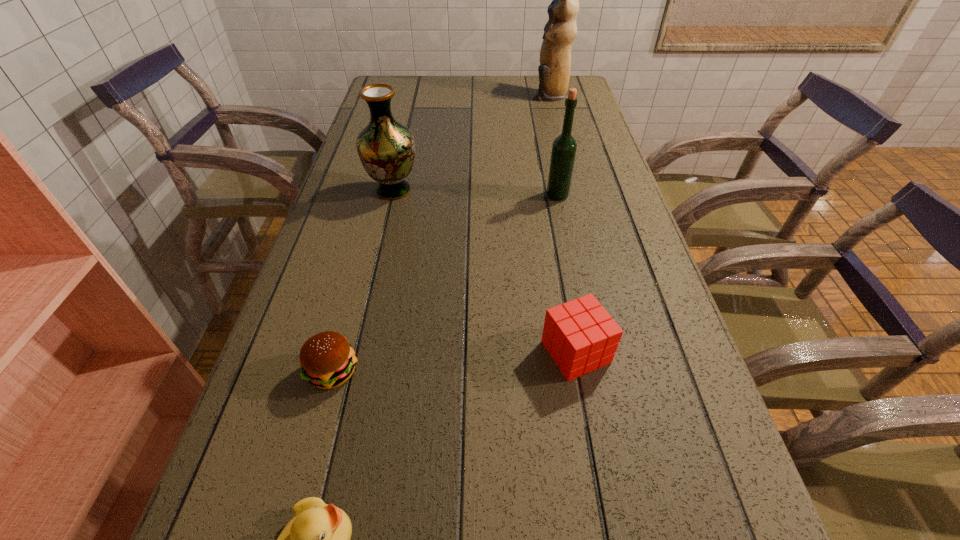
Locate an element on the screen. The image size is (960, 540). vacant space at the far edge of the desktop is located at coordinates [x=488, y=93].

The image size is (960, 540). Find the location of `vacant space at the left edge of the desktop`. vacant space at the left edge of the desktop is located at coordinates (369, 122).

You are a GUI agent. You are given a task and a screenshot of the screen. Output one action in this format:
    pyautogui.click(x=<x>, y=<y>)
    Task: Click on the free location at the right edge
    
    Given the screenshot: What is the action you would take?
    pyautogui.click(x=669, y=298)

I want to click on free space between the tallest object and the hamburger, so click(x=442, y=233).

Locate an element on the screen. Image resolution: width=960 pixels, height=540 pixels. vacant space that is in between the cube and the liquor is located at coordinates (566, 274).

Image resolution: width=960 pixels, height=540 pixels. In order to click on empty space that is in between the vase and the cube in this screenshot , I will do `click(485, 271)`.

The height and width of the screenshot is (540, 960). What are the coordinates of `vacant point located between the cube and the liquor` in the screenshot? It's located at (566, 274).

Find the location of a particular element. vacant point located between the liquor and the hamburger is located at coordinates click(445, 284).

Locate an element on the screen. vacant space that is in between the liquor and the hamburger is located at coordinates (445, 284).

Select which object is the third closest to the liquor. Please provide its 2D coordinates. Your answer should be formatted as a tuple, i.e. [(x, y)], where the tuple contains the x and y coordinates of a point satisfying the conditions above.

[(560, 31)]